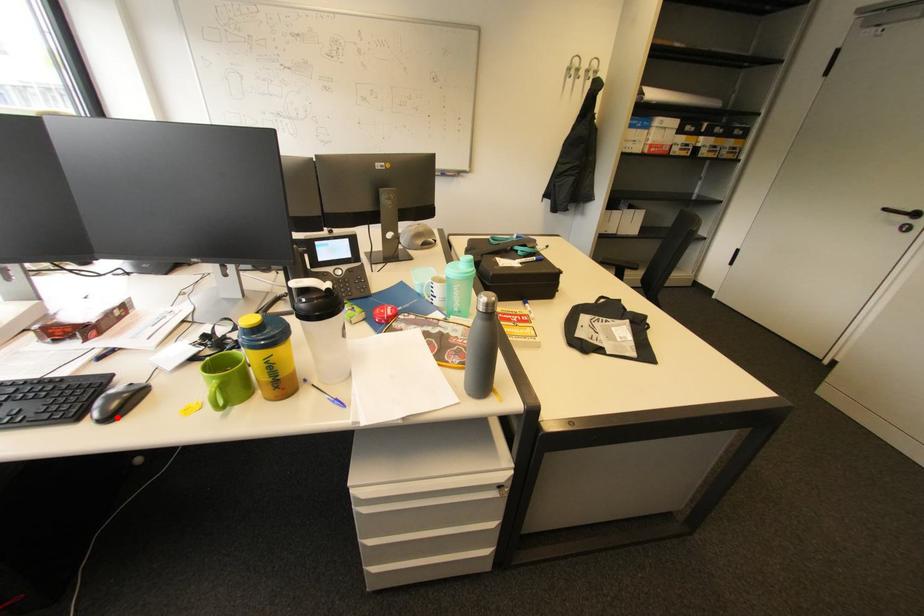
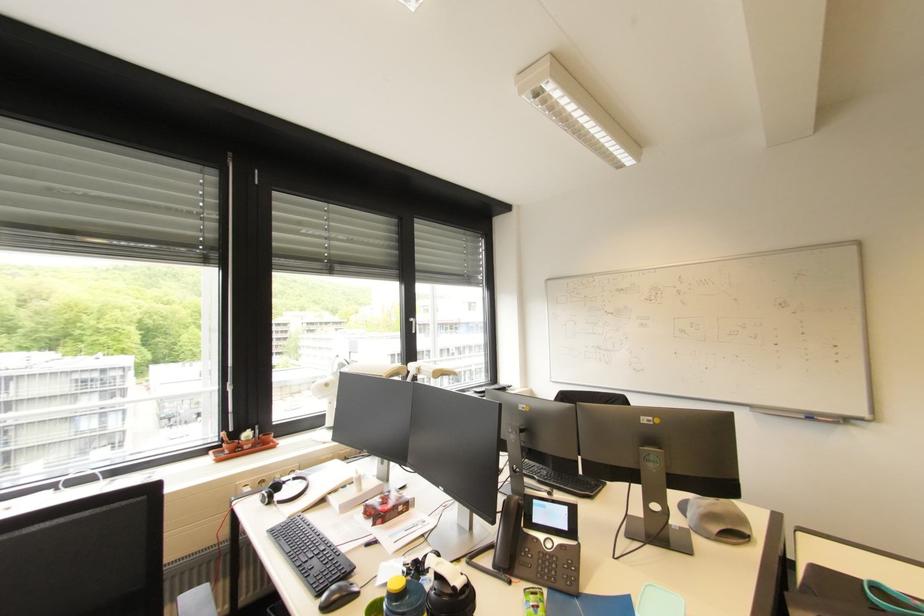
The point at the highlighted location is marked in the first image. Where is the corresponding point in the second image?

(332, 609)